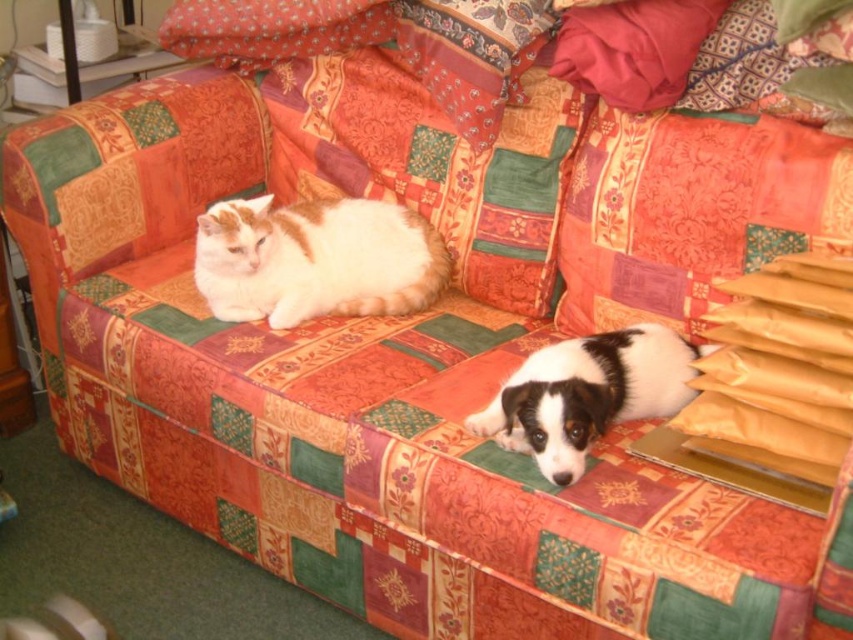
Looking at this image, which is more to the right, orange fabric pillow at upper right or white and orange fur cat at center?

orange fabric pillow at upper right is more to the right.

Can you confirm if orange fabric pillow at upper right is taller than white and orange fur cat at center?

Yes.

Who is more forward, (813, 140) or (292, 253)?

Point (813, 140)

The height and width of the screenshot is (640, 853). In order to click on orange fabric pillow at upper right in this screenshot , I will do `click(689, 211)`.

Does white and orange fur cat at center come in front of black and white fur at center?

That is False.

Which is more to the left, white and orange fur cat at center or black and white fur at center?

From the viewer's perspective, white and orange fur cat at center appears more on the left side.

Does point (241, 240) come in front of point (646, 388)?

No, it is behind (646, 388).

At what (x,y) coordinates should I click in order to perform the action: click on white and orange fur cat at center. Please return your answer as a coordinate pair (x, y). The height and width of the screenshot is (640, 853). Looking at the image, I should click on (316, 259).

Measure the distance from orange fabric pillow at upper right to black and white fur at center.

They are 29.54 centimeters apart.

How distant is orange fabric pillow at upper right from black and white fur at center?

They are 11.63 inches apart.

Which is behind, point (680, 205) or point (601, 403)?

Point (680, 205)

The width and height of the screenshot is (853, 640). In order to click on orange fabric pillow at upper right in this screenshot , I will do `click(689, 211)`.